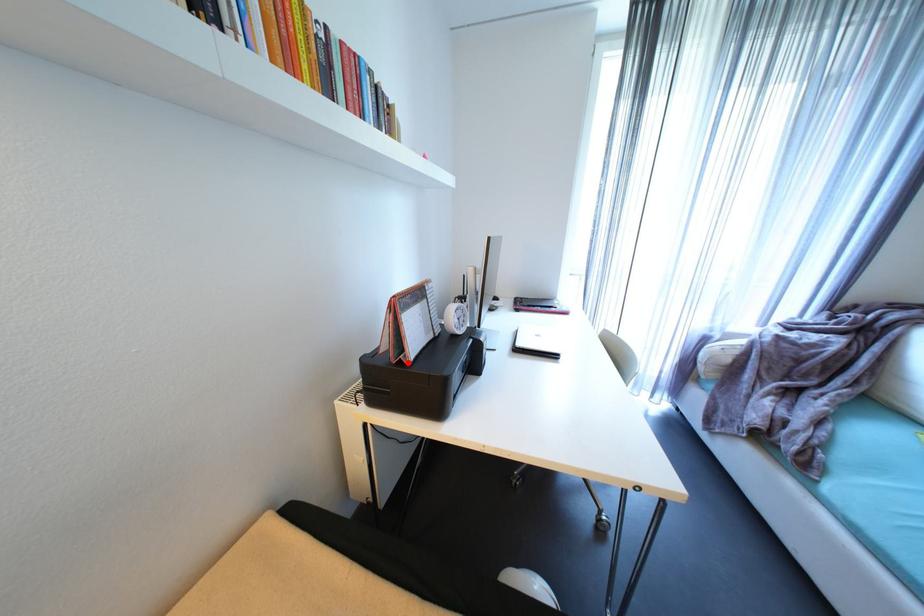
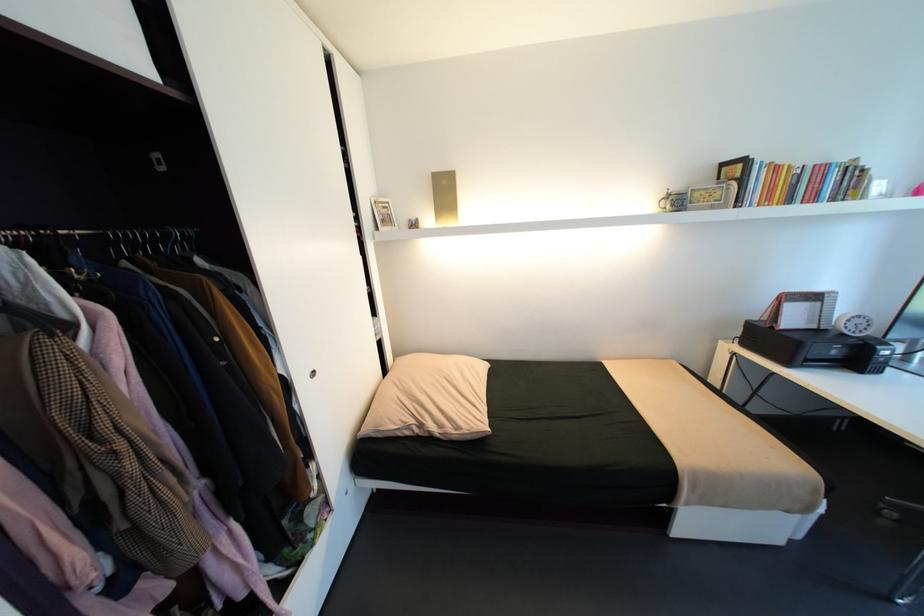
The point at the highlighted location is marked in the first image. Where is the corresponding point in the second image?

(779, 328)